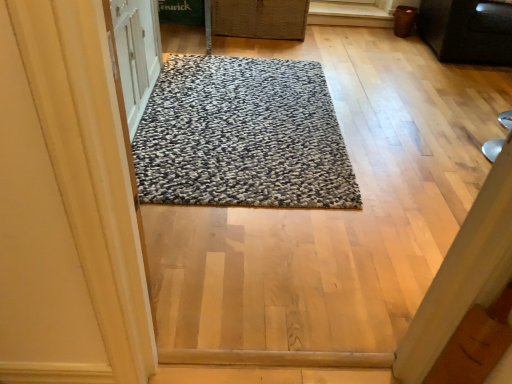
Find the location of a particular element. This screenshot has height=384, width=512. black matte cabinet at upper right is located at coordinates (467, 30).

Locate an element on the screen. The height and width of the screenshot is (384, 512). woven brown basket at upper center is located at coordinates (260, 18).

Image resolution: width=512 pixels, height=384 pixels. Describe the element at coordinates (242, 136) in the screenshot. I see `textured gray rug at center` at that location.

At what (x,y) coordinates should I click in order to perform the action: click on black matte cabinet at upper right. Please return your answer as a coordinate pair (x, y). The image size is (512, 384). Looking at the image, I should click on [x=467, y=30].

Considering the points (482, 23) and (277, 13), which point is in front, point (482, 23) or point (277, 13)?

The point (482, 23) is closer to the camera.

From a real-world perspective, is black matte cabinet at upper right physically located above or below woven brown basket at upper center?

In terms of real-world spatial position, black matte cabinet at upper right is above woven brown basket at upper center.

Is black matte cabinet at upper right looking in the opposite direction of woven brown basket at upper center?

No, woven brown basket at upper center is not at the back of black matte cabinet at upper right.

Considering the sizes of objects black matte cabinet at upper right and woven brown basket at upper center in the image provided, who is taller, black matte cabinet at upper right or woven brown basket at upper center?

black matte cabinet at upper right.

Is the depth of woven brown basket at upper center less than that of textured gray rug at center?

No, woven brown basket at upper center is behind textured gray rug at center.

Which of these two, woven brown basket at upper center or textured gray rug at center, stands taller?

woven brown basket at upper center.

Locate an element on the screen. This screenshot has width=512, height=384. basket that is behind the textured gray rug at center is located at coordinates (260, 18).

Which of these two, woven brown basket at upper center or textured gray rug at center, is wider?

textured gray rug at center.

Can you confirm if textured gray rug at center is wider than woven brown basket at upper center?

Indeed, textured gray rug at center has a greater width compared to woven brown basket at upper center.

Can you confirm if textured gray rug at center is taller than woven brown basket at upper center?

Incorrect, the height of textured gray rug at center is not larger of that of woven brown basket at upper center.

Is woven brown basket at upper center completely or partially inside textured gray rug at center?

Definitely not — woven brown basket at upper center is not inside textured gray rug at center.

Which object is further away from the camera, textured gray rug at center or woven brown basket at upper center?

woven brown basket at upper center is behind.

Is woven brown basket at upper center with black matte cabinet at upper right?

There is a gap between woven brown basket at upper center and black matte cabinet at upper right.

Which is farther, (298, 39) or (424, 30)?

The point (424, 30) is farther.

Can you confirm if woven brown basket at upper center is bigger than black matte cabinet at upper right?

Actually, woven brown basket at upper center might be smaller than black matte cabinet at upper right.

I want to click on furniture below the woven brown basket at upper center (from the image's perspective), so (467, 30).

Is the depth of black matte cabinet at upper right greater than that of textured gray rug at center?

Yes, the depth of black matte cabinet at upper right is greater than that of textured gray rug at center.

From a real-world perspective, between black matte cabinet at upper right and textured gray rug at center, who is vertically lower?

textured gray rug at center is physically lower.

Does point (469, 31) come in front of point (348, 161)?

No, (469, 31) is behind (348, 161).

Is there a large distance between textured gray rug at center and black matte cabinet at upper right?

Indeed, textured gray rug at center is not near black matte cabinet at upper right.

Considering the points (273, 150) and (443, 35), which point is behind, point (273, 150) or point (443, 35)?

The point (443, 35) is behind.

Considering the relative sizes of textured gray rug at center and black matte cabinet at upper right in the image provided, is textured gray rug at center shorter than black matte cabinet at upper right?

Yes.

From the picture: Considering the sizes of objects textured gray rug at center and black matte cabinet at upper right in the image provided, who is bigger, textured gray rug at center or black matte cabinet at upper right?

Bigger between the two is black matte cabinet at upper right.

The height and width of the screenshot is (384, 512). What are the coordinates of `basket located underneath the black matte cabinet at upper right (from a real-world perspective)` in the screenshot? It's located at (260, 18).

This screenshot has width=512, height=384. Find the location of `basket that is above the textured gray rug at center (from the image's perspective)`. basket that is above the textured gray rug at center (from the image's perspective) is located at coordinates (260, 18).

Looking at the image, which one is located closer to woven brown basket at upper center, textured gray rug at center or black matte cabinet at upper right?

textured gray rug at center.

Which object lies nearer to the anchor point woven brown basket at upper center, black matte cabinet at upper right or textured gray rug at center?

textured gray rug at center is closer to woven brown basket at upper center.

Considering their positions, is textured gray rug at center positioned closer to black matte cabinet at upper right than woven brown basket at upper center?

woven brown basket at upper center is closer to black matte cabinet at upper right.

Consider the image. Based on their spatial positions, is woven brown basket at upper center or black matte cabinet at upper right closer to textured gray rug at center?

The object closer to textured gray rug at center is woven brown basket at upper center.

Estimate the real-world distances between objects in this image. Which object is closer to black matte cabinet at upper right, woven brown basket at upper center or textured gray rug at center?

Among the two, woven brown basket at upper center is located nearer to black matte cabinet at upper right.

Based on their spatial positions, is black matte cabinet at upper right or woven brown basket at upper center closer to textured gray rug at center?

woven brown basket at upper center is closer to textured gray rug at center.

At what (x,y) coordinates should I click in order to perform the action: click on basket situated between textured gray rug at center and black matte cabinet at upper right from left to right. Please return your answer as a coordinate pair (x, y). Looking at the image, I should click on (260, 18).